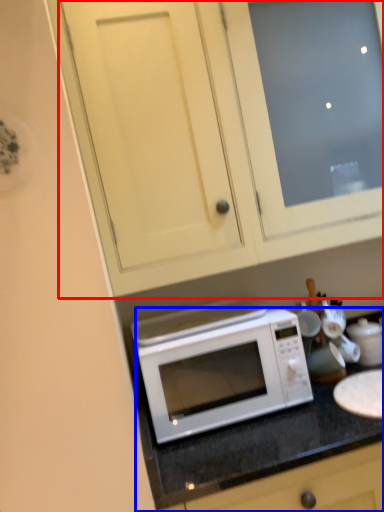
Question: Which of the following is the closest to the observer, cabinetry (highlighted by a red box) or counter (highlighted by a blue box)?

Choices:
 (A) cabinetry
 (B) counter

Answer: (B)